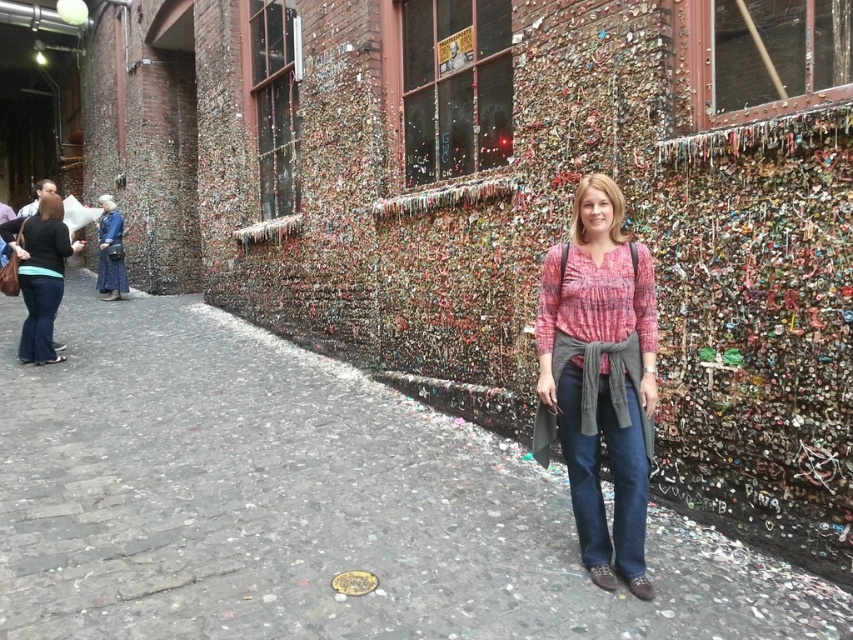
Is gray cobblestone pavement at center shorter than denim dress at left?

Yes, gray cobblestone pavement at center is shorter than denim dress at left.

Does point (86, 348) come closer to viewer compared to point (113, 278)?

Yes.

The width and height of the screenshot is (853, 640). I want to click on gray cobblestone pavement at center, so click(311, 506).

The height and width of the screenshot is (640, 853). Describe the element at coordinates (311, 506) in the screenshot. I see `gray cobblestone pavement at center` at that location.

You are a GUI agent. You are given a task and a screenshot of the screen. Output one action in this format:
    pyautogui.click(x=<x>, y=<y>)
    Task: Click on the gray cobblestone pavement at center
    The height and width of the screenshot is (640, 853).
    Given the screenshot: What is the action you would take?
    pyautogui.click(x=311, y=506)

This screenshot has height=640, width=853. In order to click on gray cobblestone pavement at center in this screenshot , I will do `click(311, 506)`.

Between gray cobblestone pavement at center and matte black shirt at left, which one appears on the right side from the viewer's perspective?

Positioned to the right is gray cobblestone pavement at center.

Does gray cobblestone pavement at center have a greater height compared to matte black shirt at left?

In fact, gray cobblestone pavement at center may be shorter than matte black shirt at left.

Between point (315, 586) and point (57, 262), which one is positioned behind?

Positioned behind is point (57, 262).

The height and width of the screenshot is (640, 853). Identify the location of gray cobblestone pavement at center. (311, 506).